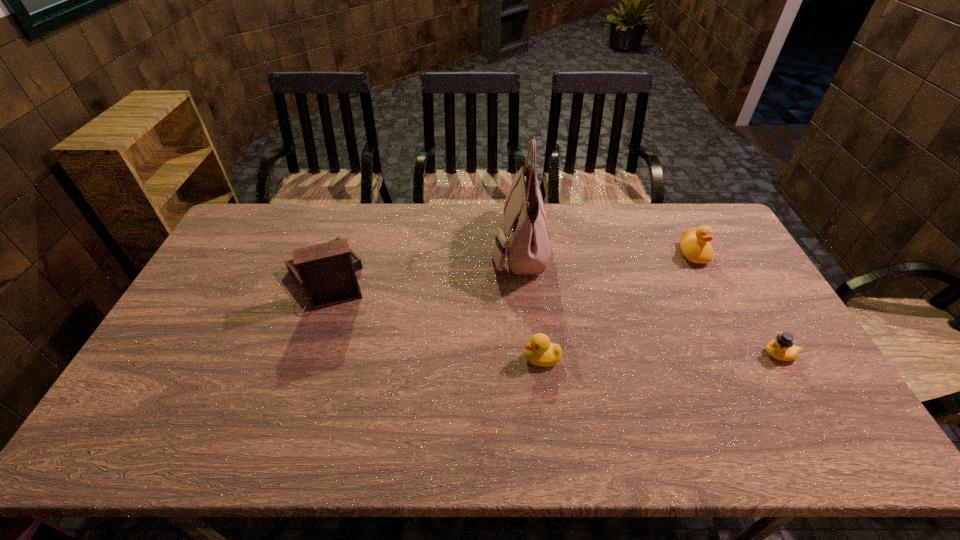
This screenshot has width=960, height=540. Identify the location of vacant space situated 0.320m on the side of the handbag with the attached pouch. (398, 246).

The image size is (960, 540). I want to click on blank area located on the side of the handbag with the attached pouch, so click(378, 246).

Locate an element on the screen. free location located 0.250m on the right of the leftmost object is located at coordinates (445, 279).

Find the location of a particular element. The height and width of the screenshot is (540, 960). vacant space located 0.160m on the face of the third tallest object is located at coordinates (719, 304).

You are a GUI agent. You are given a task and a screenshot of the screen. Output one action in this format:
    pyautogui.click(x=<x>, y=<y>)
    Task: Click on the blank area located at the beak of the second tallest duck
    This screenshot has width=960, height=540.
    Given the screenshot: What is the action you would take?
    pyautogui.click(x=376, y=359)

Where is `vacant space located at the beak of the second tallest duck`? This screenshot has width=960, height=540. vacant space located at the beak of the second tallest duck is located at coordinates (453, 359).

This screenshot has width=960, height=540. In order to click on free region located at the beak of the second tallest duck in this screenshot , I will do `click(461, 359)`.

You are a GUI agent. You are given a task and a screenshot of the screen. Output one action in this format:
    pyautogui.click(x=<x>, y=<y>)
    Task: Click on the free location located 0.060m on the front-facing side of the shortest duck
    This screenshot has height=540, width=960.
    Given the screenshot: What is the action you would take?
    pyautogui.click(x=740, y=354)

Where is `vacant space located on the front-facing side of the shortest duck`? vacant space located on the front-facing side of the shortest duck is located at coordinates (642, 354).

Locate an element on the screen. This screenshot has width=960, height=540. free point located on the front-facing side of the shortest duck is located at coordinates (697, 354).